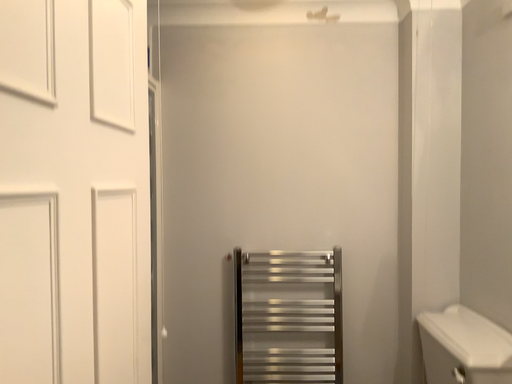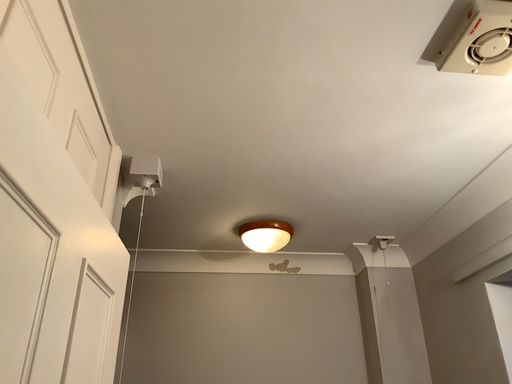
Question: How did the camera likely rotate when shooting the video?

Choices:
 (A) rotated left
 (B) rotated right

Answer: (B)